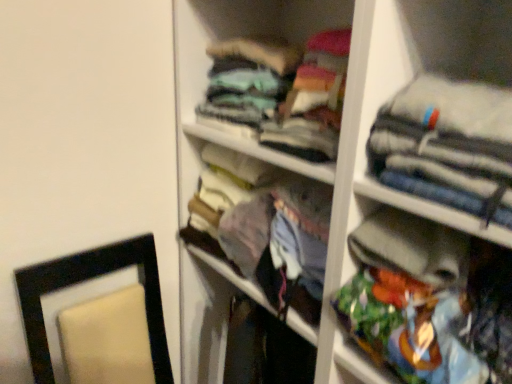
Question: Is the position of gray fabric jacket at upper right, which is the 2th clothing from top to bottom, less distant than that of multicolored fabric bag at right, which is the 3th clothing from top to bottom?

Choices:
 (A) no
 (B) yes

Answer: (B)

Question: Is multicolored fabric bag at right, which is the 3th clothing from top to bottom, at the back of gray fabric jacket at upper right, the second clothing positioned from the bottom?

Choices:
 (A) no
 (B) yes

Answer: (A)

Question: From a real-world perspective, is gray fabric jacket at upper right, which is the 2th clothing from top to bottom, located higher than multicolored fabric bag at right, which is the 3th clothing from top to bottom?

Choices:
 (A) yes
 (B) no

Answer: (A)

Question: Can you confirm if gray fabric jacket at upper right, the second clothing positioned from the bottom, is bigger than multicolored fabric bag at right, which is the first clothing from bottom to top?

Choices:
 (A) no
 (B) yes

Answer: (A)

Question: Is gray fabric jacket at upper right, the second clothing positioned from the bottom, wider than multicolored fabric bag at right, which is the first clothing from bottom to top?

Choices:
 (A) no
 (B) yes

Answer: (A)

Question: From a real-world perspective, is gray fabric jacket at upper right, which is the 2th clothing from top to bottom, above or below multicolored fabric bag at right, which is the 3th clothing from top to bottom?

Choices:
 (A) above
 (B) below

Answer: (A)

Question: Is point (458, 188) closer or farther from the camera than point (424, 324)?

Choices:
 (A) closer
 (B) farther

Answer: (A)

Question: From their relative heights in the image, would you say gray fabric jacket at upper right, the second clothing positioned from the bottom, is taller or shorter than multicolored fabric bag at right, which is the 3th clothing from top to bottom?

Choices:
 (A) tall
 (B) short

Answer: (B)

Question: From the image's perspective, is gray fabric jacket at upper right, which is the 2th clothing from top to bottom, above or below multicolored fabric bag at right, which is the 3th clothing from top to bottom?

Choices:
 (A) below
 (B) above

Answer: (B)

Question: From the image's perspective, is gray fabric jacket at upper right, the second clothing positioned from the bottom, above or below teal fabric shirt at upper center, which is the third clothing from bottom to top?

Choices:
 (A) above
 (B) below

Answer: (B)

Question: Is gray fabric jacket at upper right, which is the 2th clothing from top to bottom, situated inside teal fabric shirt at upper center, the first clothing from the top, or outside?

Choices:
 (A) inside
 (B) outside

Answer: (B)

Question: Considering the positions of gray fabric jacket at upper right, the second clothing positioned from the bottom, and teal fabric shirt at upper center, the first clothing from the top, in the image, is gray fabric jacket at upper right, the second clothing positioned from the bottom, wider or thinner than teal fabric shirt at upper center, the first clothing from the top,?

Choices:
 (A) thin
 (B) wide

Answer: (A)

Question: Would you say gray fabric jacket at upper right, the second clothing positioned from the bottom, is to the left or to the right of teal fabric shirt at upper center, which is the third clothing from bottom to top, in the picture?

Choices:
 (A) left
 (B) right

Answer: (B)

Question: In the image, is multicolored fabric bag at right, which is the first clothing from bottom to top, positioned in front of or behind teal fabric shirt at upper center, the first clothing from the top?

Choices:
 (A) front
 (B) behind

Answer: (A)

Question: Considering the positions of multicolored fabric bag at right, which is the first clothing from bottom to top, and teal fabric shirt at upper center, which is the third clothing from bottom to top, in the image, is multicolored fabric bag at right, which is the first clothing from bottom to top, wider or thinner than teal fabric shirt at upper center, which is the third clothing from bottom to top,?

Choices:
 (A) thin
 (B) wide

Answer: (A)